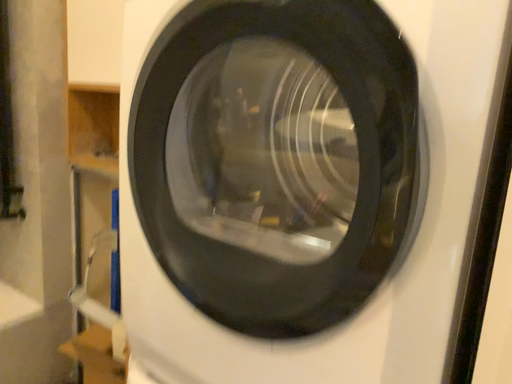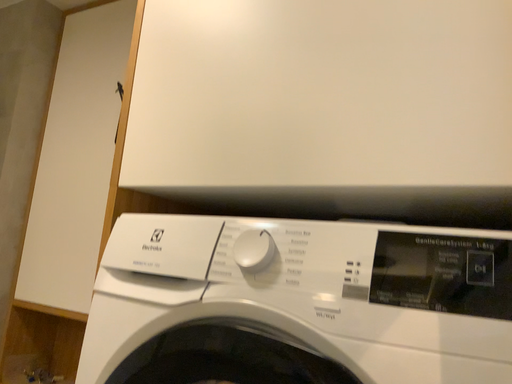
Question: Which way did the camera rotate in the video?

Choices:
 (A) rotated upward
 (B) rotated downward

Answer: (A)